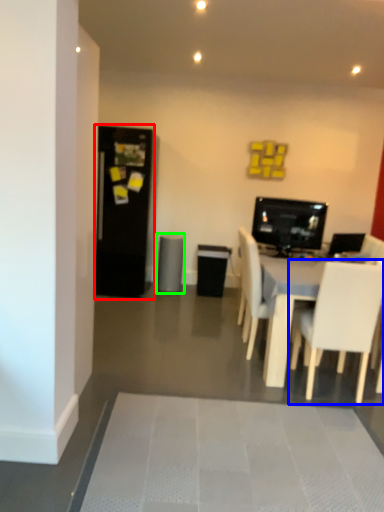
Question: Considering the real-world distances, which object is farthest from fridge (highlighted by a red box)? chair (highlighted by a blue box) or speaker (highlighted by a green box)?

Choices:
 (A) chair
 (B) speaker

Answer: (A)